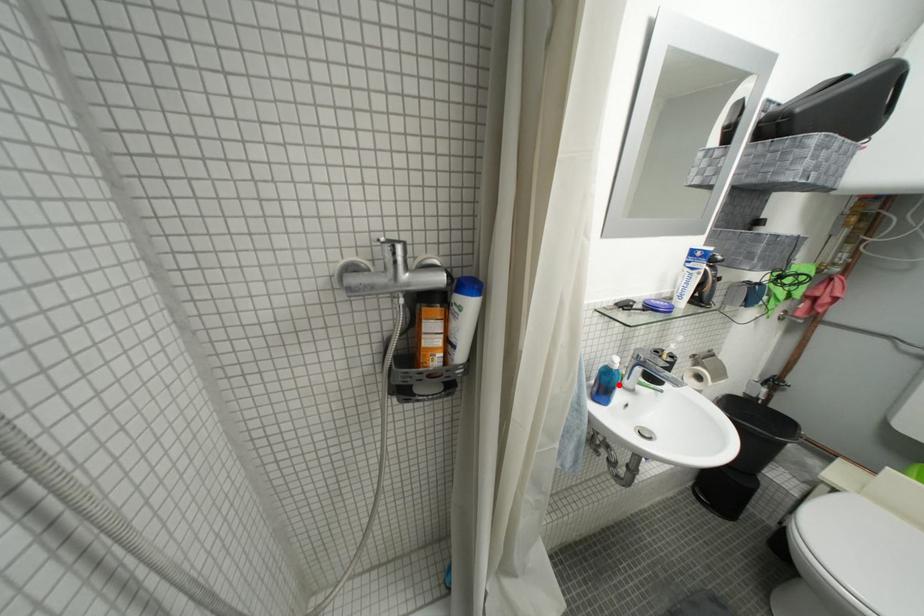
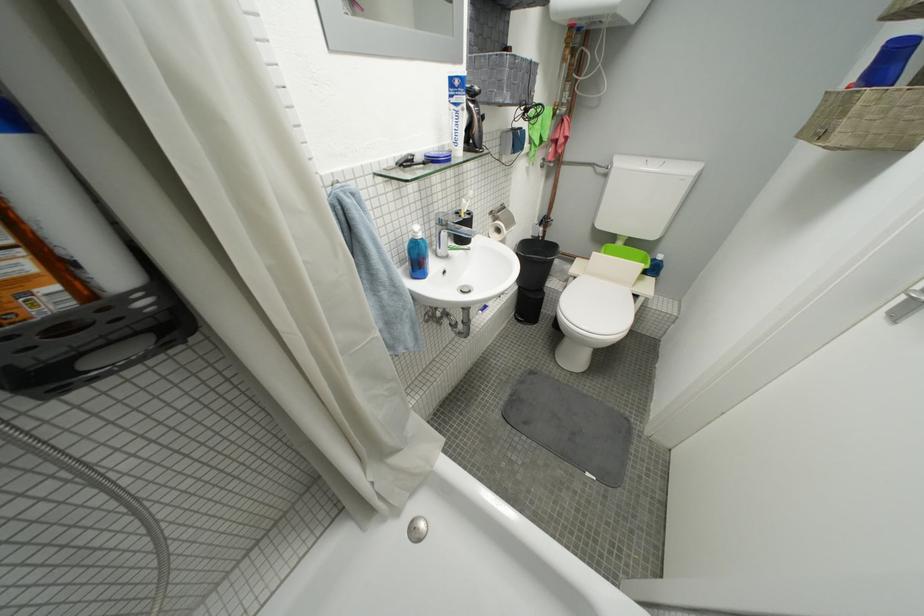
Find the pixel in the second image that matches the highlighted location in the first image.

(428, 257)